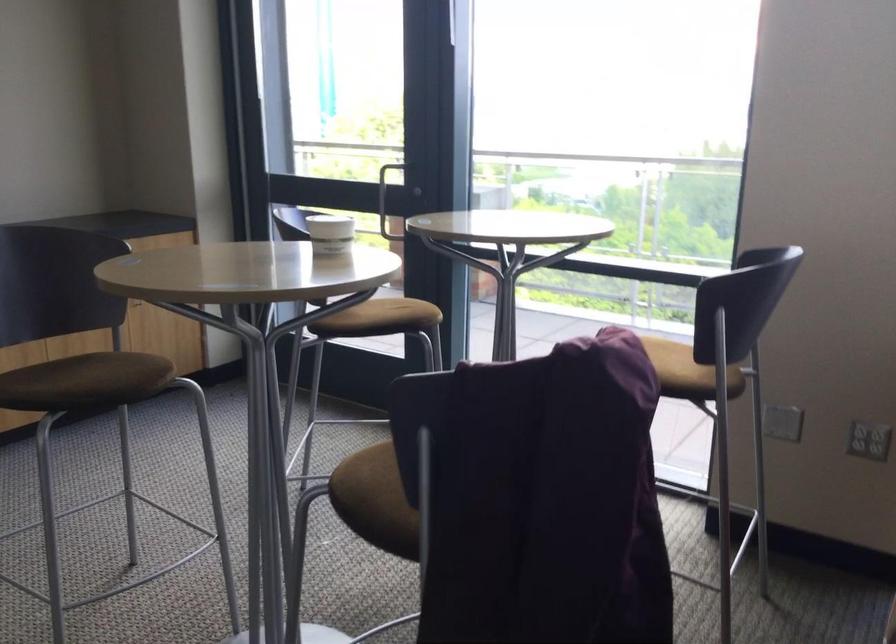
At what (x,y) coordinates should I click in order to perform the action: click on metal door handle. Please return your answer as a coordinate pair (x, y). The image size is (896, 644). Looking at the image, I should click on (383, 202).